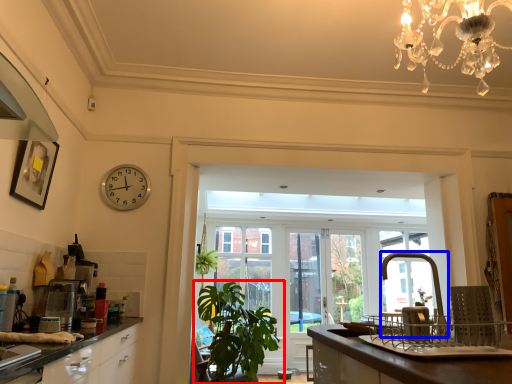
Question: Which point is further to the camera, houseplant (highlighted by a red box) or faucet (highlighted by a blue box)?

Choices:
 (A) houseplant
 (B) faucet

Answer: (A)